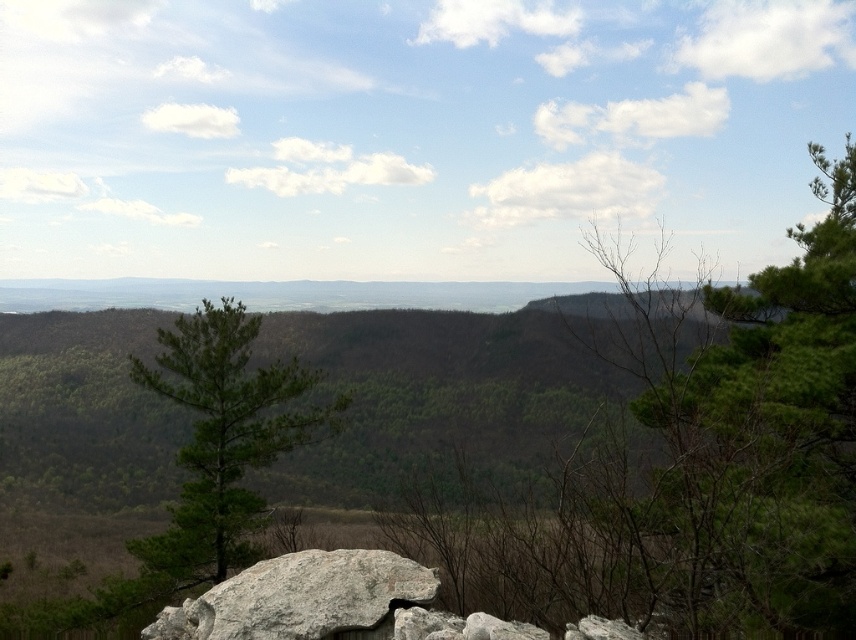
Question: Can you confirm if green matte tree at center is smaller than gray rough rock at lower center?

Choices:
 (A) yes
 (B) no

Answer: (B)

Question: Which of these objects is positioned closest to the green leafy tree at center?

Choices:
 (A) gray rough rock at lower center
 (B) green matte tree at center

Answer: (A)

Question: Which of the following is the farthest from the observer?

Choices:
 (A) green leafy tree at center
 (B) gray rough rock at lower center
 (C) green matte tree at center

Answer: (C)

Question: Does green leafy tree at center have a greater width compared to gray rough rock at lower center?

Choices:
 (A) yes
 (B) no

Answer: (A)

Question: Which point is closer to the camera taking this photo?

Choices:
 (A) (247, 540)
 (B) (729, 522)

Answer: (B)

Question: Does green matte tree at center have a smaller size compared to gray rough rock at lower center?

Choices:
 (A) no
 (B) yes

Answer: (A)